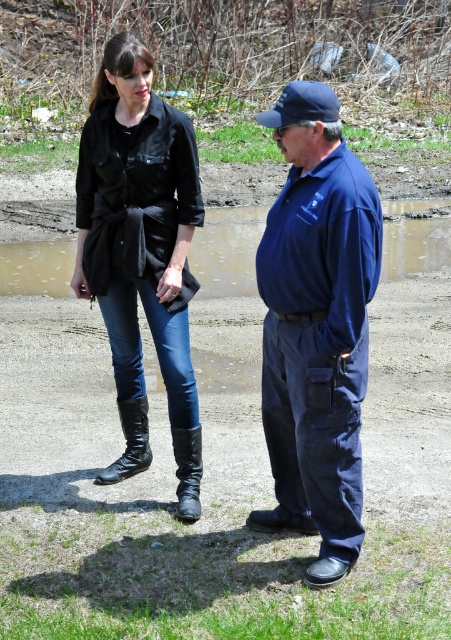
You are a photographer setting up a tripod to take a group photo of the two people in the scene. You notice the black leather boots at lower left and the black leather boot at lower left. Why do you think there are two separate entries for these items in the object list?

The black leather boots at lower left is bigger than black leather boot at lower left, indicating they might be different objects or one is a closeup while the other is part of a pair.

You are a photographer trying to capture both the black leather boots at lower left and the leather boots at center in a single frame. Which pair of boots will appear larger in the photo?

The leather boots at center will appear larger in the photo because they are closer to the photographer than the black leather boots at lower left, making them larger in the frame.